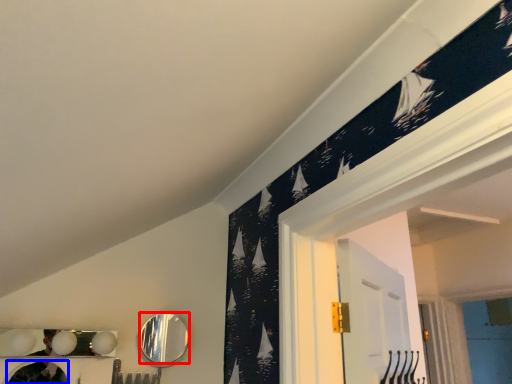
Question: Which point is closer to the camera, mirror (highlighted by a red box) or mirror (highlighted by a blue box)?

Choices:
 (A) mirror
 (B) mirror

Answer: (B)